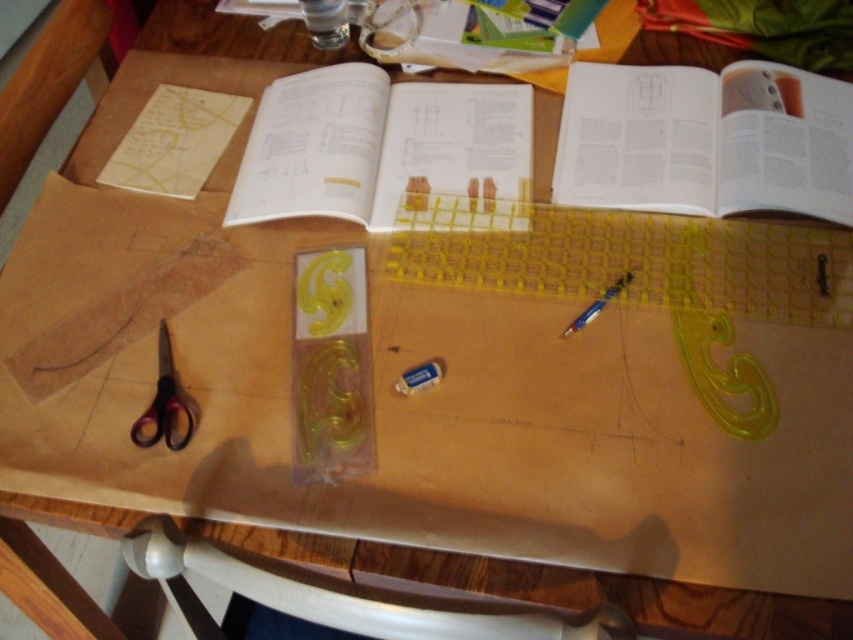
From the picture: You are organizing a craft project and need to place a sticker on the exact location of point (705, 140). The white paper book at upper right is 10 cm wide. Where should you place the sticker relative to the white paper book at upper right?

The point (705, 140) is located on the white paper book at upper right. Since the white paper book at upper right is 10 cm wide, the sticker should be placed on the white paper book at upper right, specifically at the coordinates provided.

You are organizing your desk and need to move the white matte eraser at center to the right side of the black plastic scissors at lower left. Can you do this without moving the scissors?

The black plastic scissors at lower left is in front of the white matte eraser at center, so you cannot move the eraser without moving the scissors first.